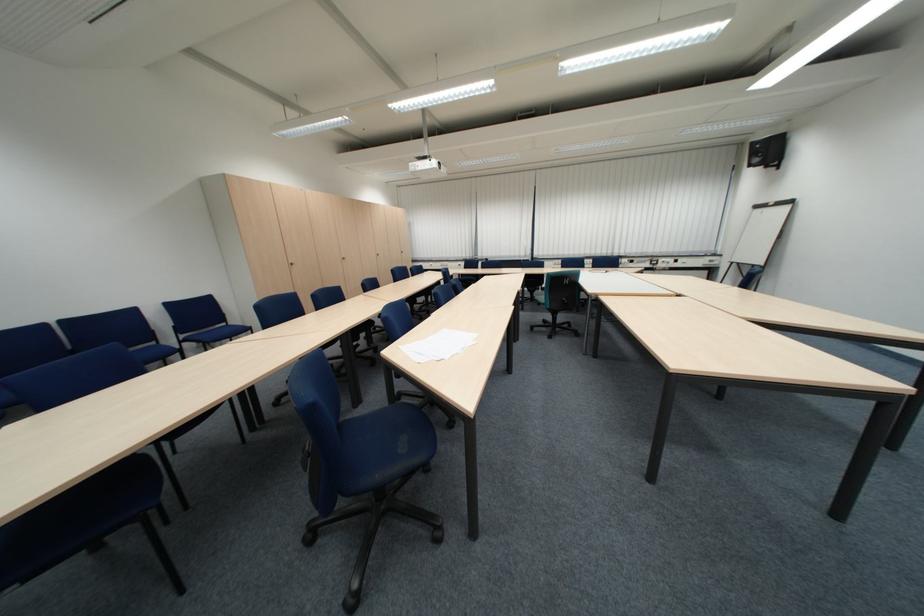
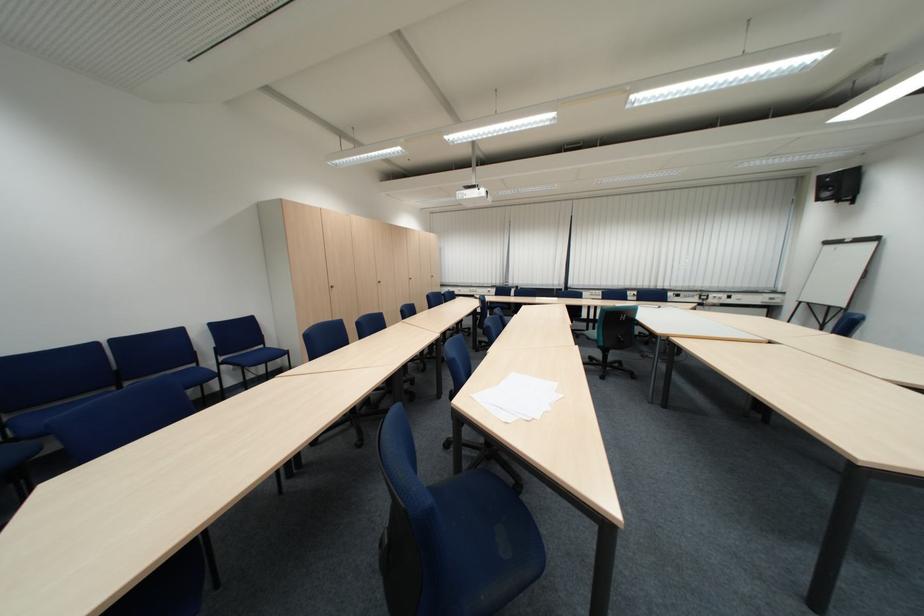
Locate, in the second image, the point that corresponds to the point at 424,353 in the first image.

(505, 407)